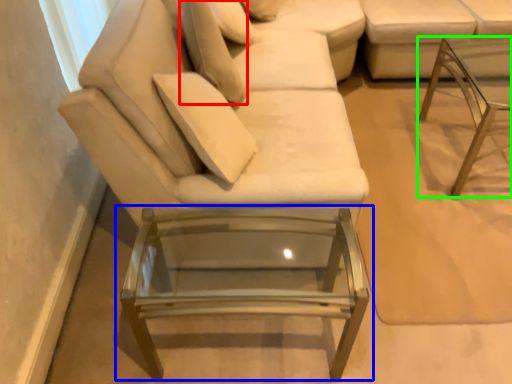
Question: Which is nearer to the pillow (highlighted by a red box)? table (highlighted by a blue box) or table (highlighted by a green box).

Choices:
 (A) table
 (B) table

Answer: (A)